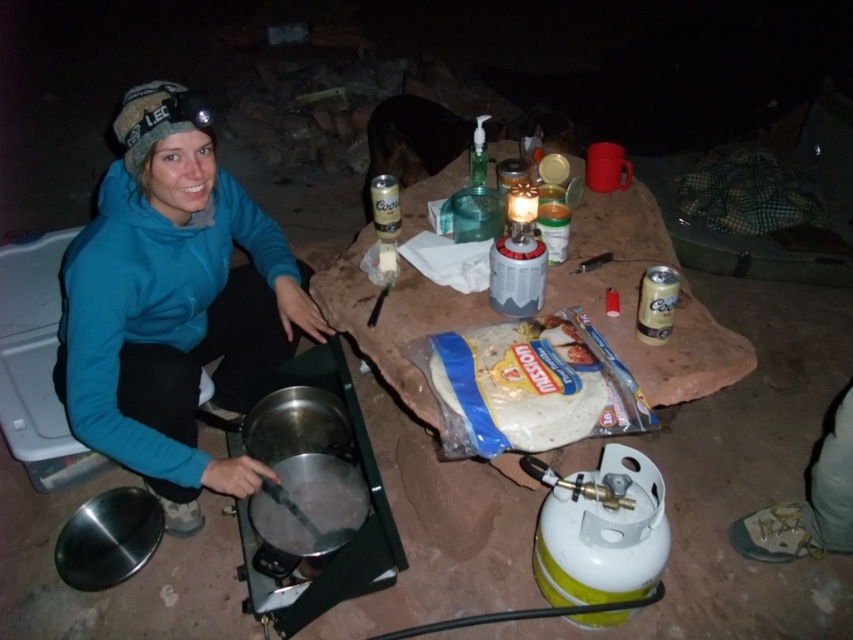
Question: Can you confirm if blue fleece jacket at center is thinner than white plastic tortillas at center?

Choices:
 (A) yes
 (B) no

Answer: (B)

Question: Does blue fleece jacket at center have a smaller size compared to white plastic tortillas at center?

Choices:
 (A) no
 (B) yes

Answer: (A)

Question: Which object appears closest to the camera in this image?

Choices:
 (A) white plastic tortillas at center
 (B) blue fleece jacket at center

Answer: (A)

Question: Can you confirm if blue fleece jacket at center is positioned below white plastic tortillas at center?

Choices:
 (A) yes
 (B) no

Answer: (B)